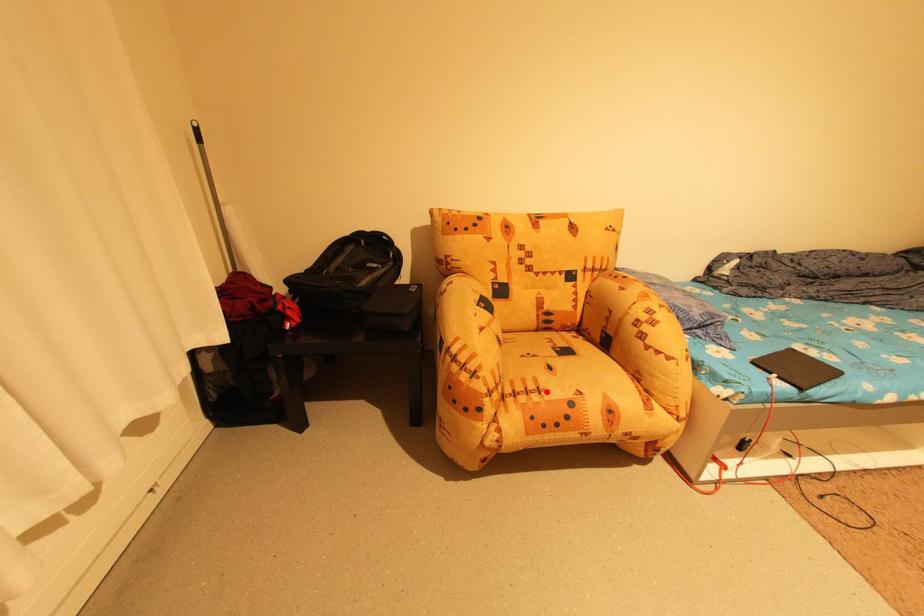
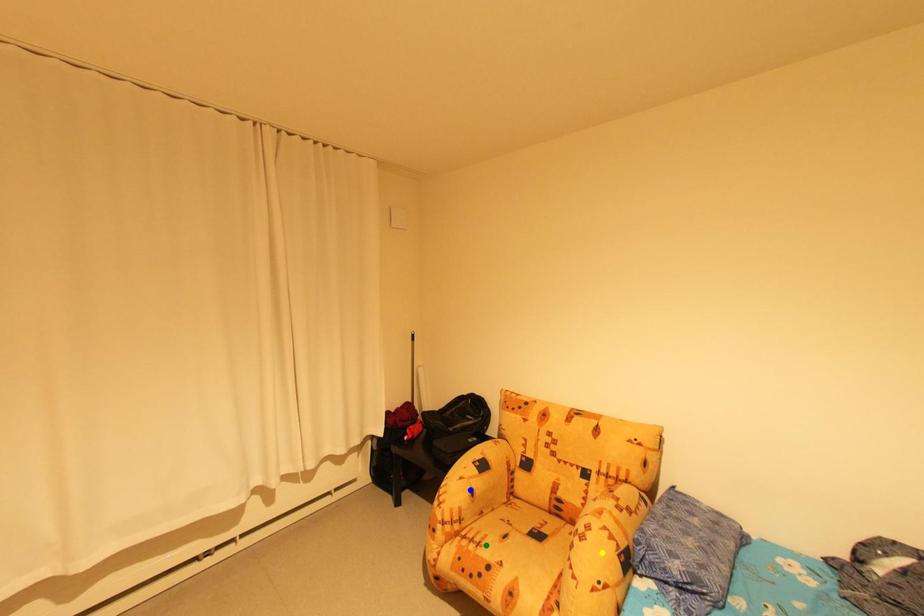
Question: I am providing you with two images of the same scene from different viewpoints. A red point is marked on the first image. You are given multiple points on the second image. In image 2, which mark is for the same physical point as the one in image 1?

Choices:
 (A) yellow point
 (B) green point
 (C) blue point

Answer: (B)